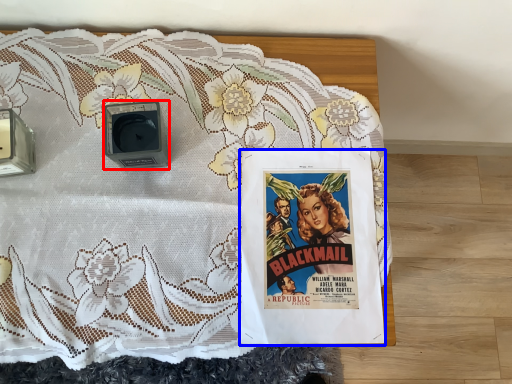
Question: Which of the following is the farthest to the observer, alarm (highlighted by a red box) or poster (highlighted by a blue box)?

Choices:
 (A) alarm
 (B) poster

Answer: (B)